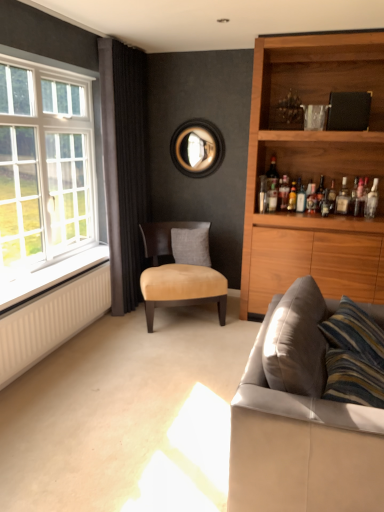
Question: Does translucent glass bottle at shelf right, the 4th bottle in the left-to-right sequence, have a lesser height compared to suede beige chair at center?

Choices:
 (A) no
 (B) yes

Answer: (B)

Question: Considering the relative sizes of translucent glass bottle at shelf right, the 4th bottle in the left-to-right sequence, and suede beige chair at center in the image provided, is translucent glass bottle at shelf right, the 4th bottle in the left-to-right sequence, wider than suede beige chair at center?

Choices:
 (A) yes
 (B) no

Answer: (B)

Question: Does translucent glass bottle at shelf right, the 4th bottle in the left-to-right sequence, have a smaller size compared to suede beige chair at center?

Choices:
 (A) yes
 (B) no

Answer: (A)

Question: Is translucent glass bottle at shelf right, which ranks as the third bottle in right-to-left order, oriented towards suede beige chair at center?

Choices:
 (A) yes
 (B) no

Answer: (B)

Question: Is translucent glass bottle at shelf right, which ranks as the third bottle in right-to-left order, at the right side of suede beige chair at center?

Choices:
 (A) no
 (B) yes

Answer: (B)

Question: Is translucent glass bottle at shelf right, the 4th bottle in the left-to-right sequence, taller than suede beige chair at center?

Choices:
 (A) yes
 (B) no

Answer: (B)

Question: Is white radiator at lower left positioned beyond the bounds of clear glass bottle at upper right, which is counted as the first bottle, starting from the left?

Choices:
 (A) no
 (B) yes

Answer: (B)

Question: Are white radiator at lower left and clear glass bottle at upper right, which is the sixth bottle in right-to-left order, far apart?

Choices:
 (A) no
 (B) yes

Answer: (B)

Question: Is white radiator at lower left wider than clear glass bottle at upper right, which is counted as the first bottle, starting from the left?

Choices:
 (A) yes
 (B) no

Answer: (A)

Question: Does white radiator at lower left have a larger size compared to clear glass bottle at upper right, which is counted as the first bottle, starting from the left?

Choices:
 (A) no
 (B) yes

Answer: (B)

Question: Can you confirm if white radiator at lower left is smaller than clear glass bottle at upper right, which is counted as the first bottle, starting from the left?

Choices:
 (A) yes
 (B) no

Answer: (B)

Question: Can you confirm if white radiator at lower left is positioned to the right of clear glass bottle at upper right, which is the sixth bottle in right-to-left order?

Choices:
 (A) no
 (B) yes

Answer: (A)

Question: Does translucent glass bottle at upper right, the 5th bottle positioned from the right, have a greater height compared to clear glass bottle at upper right, which is counted as the first bottle, starting from the left?

Choices:
 (A) yes
 (B) no

Answer: (A)